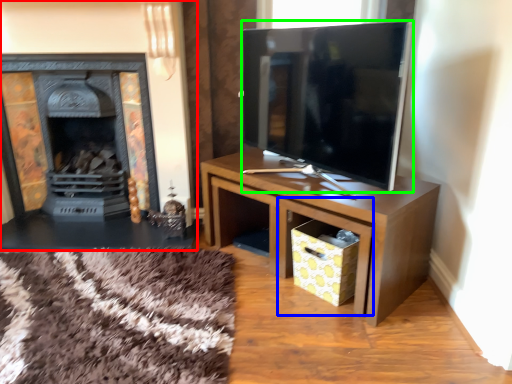
Question: Estimate the real-world distances between objects in this image. Which object is closer to fireplace (highlighted by a red box), drawer (highlighted by a blue box) or television (highlighted by a green box)?

Choices:
 (A) drawer
 (B) television

Answer: (B)